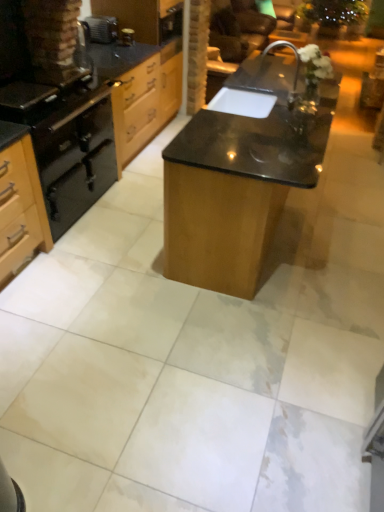
The image size is (384, 512). What are the coordinates of `empty space that is ontop of brushed metal toaster at upper left, the 2th appliance in the right-to-left sequence (from a real-world perspective)` in the screenshot? It's located at (102, 17).